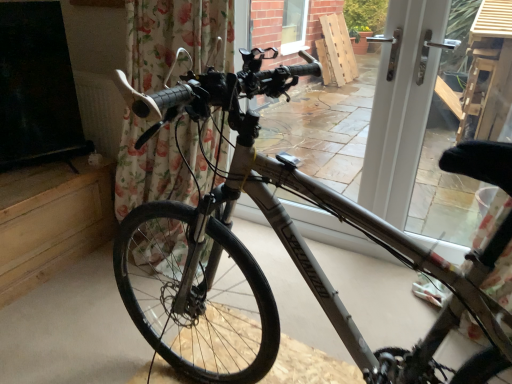
Question: Is floral fabric curtain at left wider than white plastic door at center?

Choices:
 (A) yes
 (B) no

Answer: (A)

Question: Is white plastic door at center completely or partially inside floral fabric curtain at left?

Choices:
 (A) no
 (B) yes

Answer: (A)

Question: Is floral fabric curtain at left looking in the opposite direction of white plastic door at center?

Choices:
 (A) yes
 (B) no

Answer: (B)

Question: Does floral fabric curtain at left have a smaller size compared to white plastic door at center?

Choices:
 (A) no
 (B) yes

Answer: (A)

Question: Can you confirm if floral fabric curtain at left is bigger than white plastic door at center?

Choices:
 (A) no
 (B) yes

Answer: (B)

Question: Is floral fabric curtain at left positioned far away from white plastic door at center?

Choices:
 (A) yes
 (B) no

Answer: (B)

Question: Considering the relative sizes of silver metallic bicycle at center and floral fabric curtain at left in the image provided, is silver metallic bicycle at center smaller than floral fabric curtain at left?

Choices:
 (A) no
 (B) yes

Answer: (A)

Question: From a real-world perspective, does silver metallic bicycle at center stand above floral fabric curtain at left?

Choices:
 (A) no
 (B) yes

Answer: (A)

Question: Does silver metallic bicycle at center turn towards floral fabric curtain at left?

Choices:
 (A) yes
 (B) no

Answer: (B)

Question: From the image's perspective, is silver metallic bicycle at center over floral fabric curtain at left?

Choices:
 (A) no
 (B) yes

Answer: (A)

Question: Is silver metallic bicycle at center located outside floral fabric curtain at left?

Choices:
 (A) no
 (B) yes

Answer: (B)

Question: Is silver metallic bicycle at center far from floral fabric curtain at left?

Choices:
 (A) no
 (B) yes

Answer: (A)

Question: Could you tell me if white plastic door at center is turned towards floral fabric curtain at left?

Choices:
 (A) yes
 (B) no

Answer: (A)